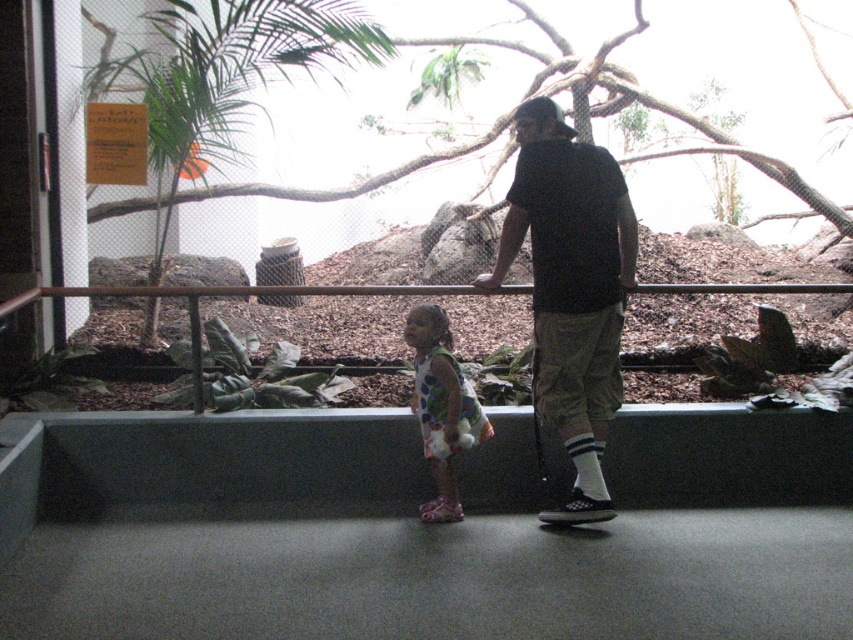
You are a photographer trying to capture a clear shot of the glass enclosure in the zoo exhibit. You notice two visitors wearing a dark gray cotton shirt at center and a printed fabric dress at center are blocking your view. Which visitor is more likely to be blocking a larger portion of the enclosure due to their clothing size?

The dark gray cotton shirt at center might be wider than the printed fabric dress at center, so the visitor in the dark gray cotton shirt at center is more likely to be blocking a larger portion of the enclosure.

You are a zoo visitor trying to take a photo of the animals inside the enclosure. You notice two people in front of you blocking your view. One is wearing a dark gray cotton shirt at center and the other a printed fabric dress at center. Which of these two is blocking more of your view?

The dark gray cotton shirt at center is larger in size than the printed fabric dress at center, so it is blocking more of your view.

You are a visitor at the zoo looking at the enclosure. There are two people in front of you wearing a dark gray cotton shirt at center and a printed fabric dress at center. Which person is blocking your view of the enclosure more?

The dark gray cotton shirt at center is closer to the viewer than the printed fabric dress at center, so the person in the dark gray cotton shirt at center is blocking your view more.